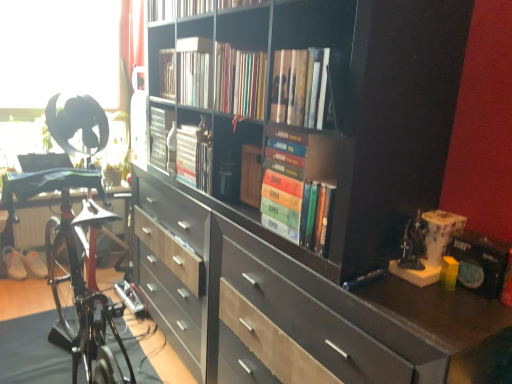
Describe the element at coordinates (298, 185) in the screenshot. I see `hardcover books at center, the fourth book viewed from the back` at that location.

You are a GUI agent. You are given a task and a screenshot of the screen. Output one action in this format:
    pyautogui.click(x=<x>, y=<y>)
    Task: Click on the hardcover books at center, the fourth book viewed from the back
    Image resolution: width=512 pixels, height=384 pixels.
    Given the screenshot: What is the action you would take?
    pyautogui.click(x=298, y=185)

What do you see at coordinates (13, 263) in the screenshot? Image resolution: width=512 pixels, height=384 pixels. I see `white fabric shoe at lower left, arranged as the second footwear when viewed from the right` at bounding box center [13, 263].

The image size is (512, 384). I want to click on white glossy bottle at center, marked as the first book in a back-to-front arrangement, so click(159, 135).

In order to face white glossy bottle at center, marked as the first book in a back-to-front arrangement, should I rotate leftwards or rightwards?

You should rotate left by 11.578 degrees.

The image size is (512, 384). Find the location of `matte black bookcase at center`. matte black bookcase at center is located at coordinates (320, 215).

Describe the element at coordinates (300, 87) in the screenshot. Image resolution: width=512 pixels, height=384 pixels. I see `hardcover books at center, the 1th book when ordered from front to back` at that location.

Image resolution: width=512 pixels, height=384 pixels. Identify the location of hardcover books at center, acting as the second book starting from the front. (298, 185).

Is the surface of satin silver book at center, which is the second book from back to front, in direct contact with matte black paperback book at right?

No, satin silver book at center, which is the second book from back to front, is not making contact with matte black paperback book at right.

Can you tell me how much satin silver book at center, which is the second book from back to front, and matte black paperback book at right differ in facing direction?

The facing directions of satin silver book at center, which is the second book from back to front, and matte black paperback book at right are 0.63 degrees apart.

Based on their sizes in the image, would you say satin silver book at center, which is the second book from back to front, is bigger or smaller than matte black paperback book at right?

Clearly, satin silver book at center, which is the second book from back to front, is larger in size than matte black paperback book at right.

Is satin silver book at center, the 4th book when ordered from front to back, positioned behind matte black paperback book at right?

Yes.

Locate an element on the screen. This screenshot has height=384, width=512. the 2nd book behind the hardcover books at center, which is the 3th book in front-to-back order, starting your count from the anchor is located at coordinates (159, 135).

From their relative heights in the image, would you say white glossy bottle at center, which ranks as the 5th book in front-to-back order, is taller or shorter than hardcover books at center, which is the 3th book in front-to-back order?

In the image, white glossy bottle at center, which ranks as the 5th book in front-to-back order, appears to be taller than hardcover books at center, which is the 3th book in front-to-back order.

Is hardcover books at center, which is the 3th book in front-to-back order, a part of white glossy bottle at center, marked as the first book in a back-to-front arrangement?

No, hardcover books at center, which is the 3th book in front-to-back order, is located outside of white glossy bottle at center, marked as the first book in a back-to-front arrangement.

Considering the sizes of objects white glossy bottle at center, marked as the first book in a back-to-front arrangement, and hardcover books at center, which is the 3th book in front-to-back order, in the image provided, who is bigger, white glossy bottle at center, marked as the first book in a back-to-front arrangement, or hardcover books at center, which is the 3th book in front-to-back order,?

Bigger between the two is hardcover books at center, which is the 3th book in front-to-back order.

Is white glossy bottle at center, which ranks as the 5th book in front-to-back order, far from white fabric shoe at lower left, acting as the 1th footwear starting from the left?

Yes, white glossy bottle at center, which ranks as the 5th book in front-to-back order, is far from white fabric shoe at lower left, acting as the 1th footwear starting from the left.

Can white fabric shoe at lower left, acting as the 1th footwear starting from the left, be found inside white glossy bottle at center, which ranks as the 5th book in front-to-back order?

No, white glossy bottle at center, which ranks as the 5th book in front-to-back order, does not contain white fabric shoe at lower left, acting as the 1th footwear starting from the left.

From the image's perspective, is white glossy bottle at center, which ranks as the 5th book in front-to-back order, positioned above or below white fabric shoe at lower left, acting as the 1th footwear starting from the left?

From the image's perspective, white glossy bottle at center, which ranks as the 5th book in front-to-back order, appears above white fabric shoe at lower left, acting as the 1th footwear starting from the left.

Does matte black paperback book at right have a lesser height compared to white matte sneakers at lower left, which appears as the first footwear when viewed from the right?

Yes, matte black paperback book at right is shorter than white matte sneakers at lower left, which appears as the first footwear when viewed from the right.

Who is smaller, matte black paperback book at right or white matte sneakers at lower left, which appears as the first footwear when viewed from the right?

matte black paperback book at right.

Which is behind, matte black paperback book at right or white matte sneakers at lower left, which appears as the first footwear when viewed from the right?

Positioned behind is white matte sneakers at lower left, which appears as the first footwear when viewed from the right.

Which of these two, hardcover books at center, which is the 3th book in front-to-back order, or satin silver book at center, the 4th book when ordered from front to back, is wider?

hardcover books at center, which is the 3th book in front-to-back order.

Considering the relative sizes of hardcover books at center, which is the 3th book in front-to-back order, and satin silver book at center, the 4th book when ordered from front to back, in the image provided, is hardcover books at center, which is the 3th book in front-to-back order, bigger than satin silver book at center, the 4th book when ordered from front to back,?

Correct, hardcover books at center, which is the 3th book in front-to-back order, is larger in size than satin silver book at center, the 4th book when ordered from front to back.

Is hardcover books at center, which is the 3th book in front-to-back order, oriented towards satin silver book at center, the 4th book when ordered from front to back?

No, hardcover books at center, which is the 3th book in front-to-back order, is not oriented towards satin silver book at center, the 4th book when ordered from front to back.

From the image's perspective, count 3rd books upward from the satin silver book at center, the 4th book when ordered from front to back, and point to it. Please provide its 2D coordinates.

[(240, 81)]

Is hardcover books at center, acting as the second book starting from the front, a part of hardcover books at center, which ranks as the 3th book in back-to-front order?

No, hardcover books at center, acting as the second book starting from the front, is located outside of hardcover books at center, which ranks as the 3th book in back-to-front order.

From the picture: Is hardcover books at center, which ranks as the 3th book in back-to-front order, facing towards hardcover books at center, acting as the second book starting from the front?

No, hardcover books at center, which ranks as the 3th book in back-to-front order, is not facing towards hardcover books at center, acting as the second book starting from the front.

Based on their positions, is hardcover books at center, which ranks as the 3th book in back-to-front order, located to the left or right of hardcover books at center, acting as the second book starting from the front?

From the image, it's evident that hardcover books at center, which ranks as the 3th book in back-to-front order, is to the left of hardcover books at center, acting as the second book starting from the front.

Is hardcover books at center, which ranks as the 3th book in back-to-front order, far away from hardcover books at center, acting as the second book starting from the front?

No, there isn't a large distance between hardcover books at center, which ranks as the 3th book in back-to-front order, and hardcover books at center, acting as the second book starting from the front.

Considering the relative sizes of matte black paperback book at right and white fabric shoe at lower left, arranged as the second footwear when viewed from the right, in the image provided, is matte black paperback book at right taller than white fabric shoe at lower left, arranged as the second footwear when viewed from the right,?

Incorrect, the height of matte black paperback book at right is not larger of that of white fabric shoe at lower left, arranged as the second footwear when viewed from the right.

From the image's perspective, which object appears higher, matte black paperback book at right or white fabric shoe at lower left, acting as the 1th footwear starting from the left?

matte black paperback book at right is shown above in the image.

Find the location of a particular element. The width and height of the screenshot is (512, 384). paperback book above the white fabric shoe at lower left, acting as the 1th footwear starting from the left (from the image's perspective) is located at coordinates (480, 262).

Looking at their sizes, would you say matte black paperback book at right is wider or thinner than white fabric shoe at lower left, arranged as the second footwear when viewed from the right?

matte black paperback book at right is thinner than white fabric shoe at lower left, arranged as the second footwear when viewed from the right.

The image size is (512, 384). There is a matte black paperback book at right. Find the location of `the 2nd book above it (from the image's perspective)`. the 2nd book above it (from the image's perspective) is located at coordinates (194, 155).

The image size is (512, 384). In order to click on the 2nd book positioned below the hardcover books at center, which ranks as the 3th book in back-to-front order (from the image's perspective) in this screenshot , I will do `click(159, 135)`.

Considering their positions, is white fabric shoe at lower left, acting as the 1th footwear starting from the left, positioned closer to white matte sneakers at lower left, which appears as the first footwear when viewed from the right, than hardcover books at center, the 1th book when ordered from front to back?

Based on the image, white fabric shoe at lower left, acting as the 1th footwear starting from the left, appears to be nearer to white matte sneakers at lower left, which appears as the first footwear when viewed from the right.

From the image, which object appears to be farther from satin silver book at center, the 4th book when ordered from front to back, matte black paperback book at right or hardcover books at center, the fourth book viewed from the back?

Based on the image, matte black paperback book at right appears to be further to satin silver book at center, the 4th book when ordered from front to back.

When comparing their distances from hardcover books at center, acting as the second book starting from the front, does white glossy bottle at center, marked as the first book in a back-to-front arrangement, or white matte sneakers at lower left, positioned as the 2th footwear in left-to-right order, seem further?

white matte sneakers at lower left, positioned as the 2th footwear in left-to-right order.

When comparing their distances from white fabric shoe at lower left, arranged as the second footwear when viewed from the right, does hardcover books at center, acting as the second book starting from the front, or hardcover books at center, which appears as the 5th book when viewed from the back, seem closer?

hardcover books at center, acting as the second book starting from the front, is closer to white fabric shoe at lower left, arranged as the second footwear when viewed from the right.

From the image, which object appears to be farther from hardcover books at center, which is the 3th book in front-to-back order, white glossy bottle at center, which ranks as the 5th book in front-to-back order, or hardcover books at center, which appears as the 5th book when viewed from the back?

white glossy bottle at center, which ranks as the 5th book in front-to-back order, is positioned further to the anchor hardcover books at center, which is the 3th book in front-to-back order.

Based on their spatial positions, is white fabric shoe at lower left, arranged as the second footwear when viewed from the right, or matte black paperback book at right further from white matte sneakers at lower left, which appears as the first footwear when viewed from the right?

matte black paperback book at right.

Considering their positions, is matte black bookcase at center positioned further to hardcover books at center, which appears as the 5th book when viewed from the back, than white matte sneakers at lower left, which appears as the first footwear when viewed from the right?

white matte sneakers at lower left, which appears as the first footwear when viewed from the right.

Estimate the real-world distances between objects in this image. Which object is further from hardcover books at center, acting as the second book starting from the front, white fabric shoe at lower left, arranged as the second footwear when viewed from the right, or hardcover books at center, which ranks as the 3th book in back-to-front order?

white fabric shoe at lower left, arranged as the second footwear when viewed from the right.

You are a GUI agent. You are given a task and a screenshot of the screen. Output one action in this format:
    pyautogui.click(x=<x>, y=<y>)
    Task: Click on the book between white matte sneakers at lower left, positioned as the 2th footwear in left-to-right order, and satin silver book at center, the 4th book when ordered from front to back, in the horizontal direction
    This screenshot has height=384, width=512.
    Given the screenshot: What is the action you would take?
    pyautogui.click(x=159, y=135)

Image resolution: width=512 pixels, height=384 pixels. Find the location of `footwear between white fabric shoe at lower left, acting as the 1th footwear starting from the left, and satin silver book at center, which is the second book from back to front, from left to right`. footwear between white fabric shoe at lower left, acting as the 1th footwear starting from the left, and satin silver book at center, which is the second book from back to front, from left to right is located at coordinates (34, 263).

Locate an element on the screen. This screenshot has width=512, height=384. paperback book between matte black bookcase at center and white matte sneakers at lower left, positioned as the 2th footwear in left-to-right order, along the z-axis is located at coordinates (480, 262).

Where is `book located between hardcover books at center, acting as the second book starting from the front, and satin silver book at center, the 4th book when ordered from front to back, in the depth direction`? The width and height of the screenshot is (512, 384). book located between hardcover books at center, acting as the second book starting from the front, and satin silver book at center, the 4th book when ordered from front to back, in the depth direction is located at coordinates (240, 81).